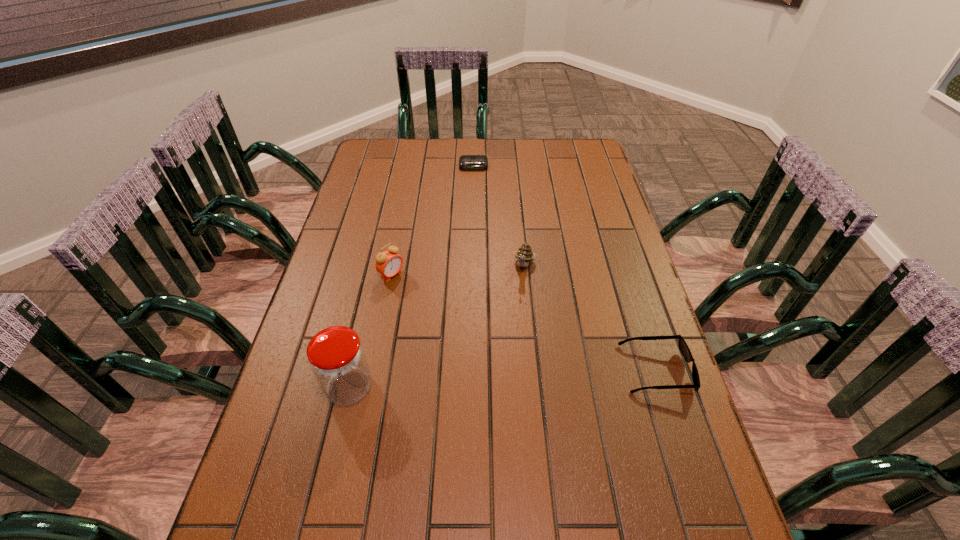
Image resolution: width=960 pixels, height=540 pixels. What are the coordinates of `vacant area between the tallest object and the nearer alarm clock` in the screenshot? It's located at (371, 331).

Locate an element on the screen. free space that is in between the second object from right to left and the taller alarm clock is located at coordinates (458, 271).

Where is `empty space between the second object from right to left and the third object from right to left`? empty space between the second object from right to left and the third object from right to left is located at coordinates (499, 216).

Where is `free space between the jar and the nearer alarm clock`? This screenshot has width=960, height=540. free space between the jar and the nearer alarm clock is located at coordinates (371, 331).

I want to click on vacant area between the snail and the left alarm clock, so click(458, 271).

The width and height of the screenshot is (960, 540). I want to click on vacant area that lies between the tallest object and the right alarm clock, so click(x=412, y=276).

I want to click on vacant space that is in between the shorter alarm clock and the fourth object from left to right, so click(499, 216).

Where is `object that is the fourth closest one to the rightmost object`? Image resolution: width=960 pixels, height=540 pixels. object that is the fourth closest one to the rightmost object is located at coordinates (466, 162).

Locate which object ranks fourth in proximity to the tallest object. Please provide its 2D coordinates. Your answer should be formatted as a tuple, i.e. [(x, y)], where the tuple contains the x and y coordinates of a point satisfying the conditions above.

[(466, 162)]

Where is `free point that satisfies the following two spatial constraints: 1. on the front side of the third object from right to left; 2. on the left side of the snail`? free point that satisfies the following two spatial constraints: 1. on the front side of the third object from right to left; 2. on the left side of the snail is located at coordinates (471, 266).